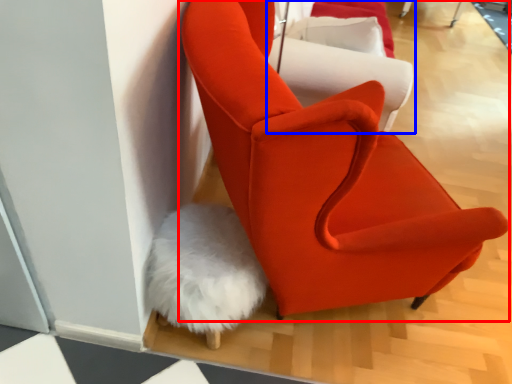
Question: Which point is closer to the camera, chair (highlighted by a red box) or chair (highlighted by a blue box)?

Choices:
 (A) chair
 (B) chair

Answer: (A)